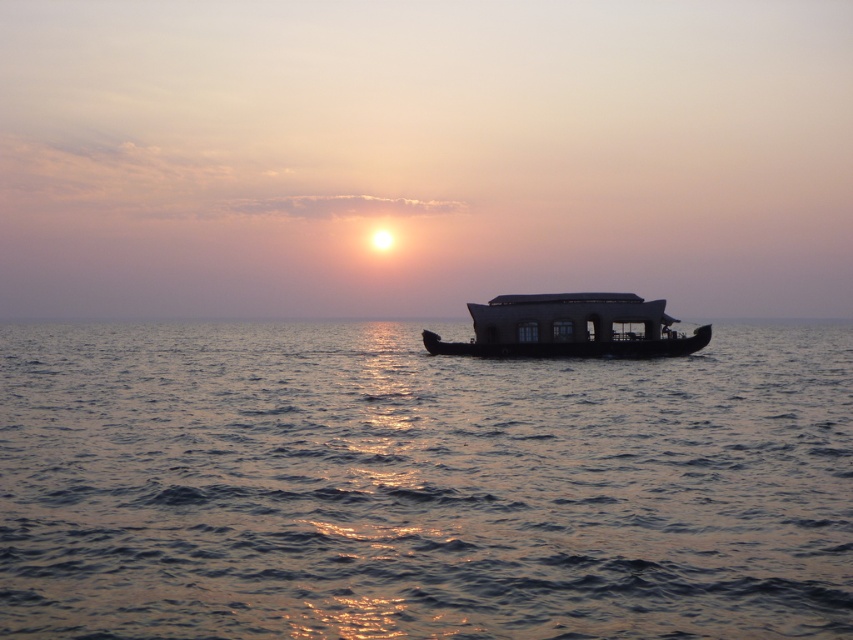
Is blue water at center behind dark brown wooden houseboat at center?

No, it is in front of dark brown wooden houseboat at center.

Is blue water at center smaller than dark brown wooden houseboat at center?

No, blue water at center is not smaller than dark brown wooden houseboat at center.

The width and height of the screenshot is (853, 640). What are the coordinates of `blue water at center` in the screenshot? It's located at (419, 484).

The width and height of the screenshot is (853, 640). I want to click on blue water at center, so click(x=419, y=484).